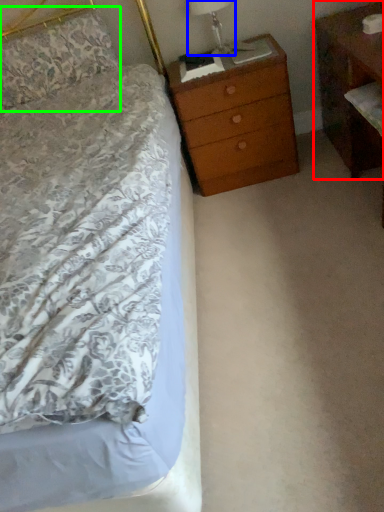
Question: Estimate the real-world distances between objects in this image. Which object is farther from nightstand (highlighted by a red box), bedside lamp (highlighted by a blue box) or pillow (highlighted by a green box)?

Choices:
 (A) bedside lamp
 (B) pillow

Answer: (B)